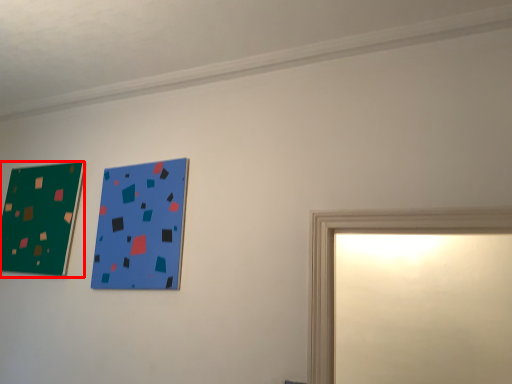
Question: Considering the relative positions of picture frame (annotated by the red box) and picture frame in the image provided, where is picture frame (annotated by the red box) located with respect to the staircase?

Choices:
 (A) left
 (B) right

Answer: (A)